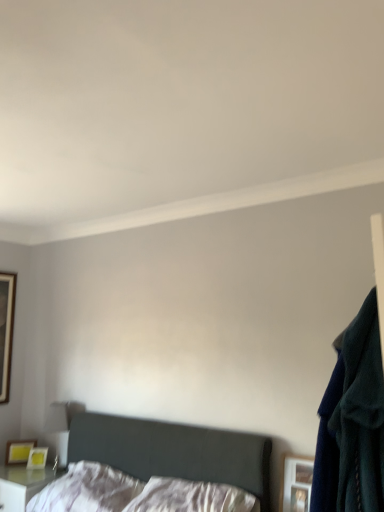
Question: Should I look upward or downward to see white soft pillow at lower center, arranged as the second pillow when viewed from the right?

Choices:
 (A) up
 (B) down

Answer: (B)

Question: Can you confirm if navy blue sweater at right is positioned to the right of white glossy nightstand at lower left?

Choices:
 (A) no
 (B) yes

Answer: (B)

Question: Does navy blue sweater at right appear on the left side of white glossy nightstand at lower left?

Choices:
 (A) yes
 (B) no

Answer: (B)

Question: Is navy blue sweater at right placed right next to white glossy nightstand at lower left?

Choices:
 (A) no
 (B) yes

Answer: (A)

Question: Considering the relative sizes of navy blue sweater at right and white glossy nightstand at lower left in the image provided, is navy blue sweater at right smaller than white glossy nightstand at lower left?

Choices:
 (A) yes
 (B) no

Answer: (A)

Question: Considering the relative sizes of navy blue sweater at right and white glossy nightstand at lower left in the image provided, is navy blue sweater at right thinner than white glossy nightstand at lower left?

Choices:
 (A) no
 (B) yes

Answer: (B)

Question: From the image's perspective, is navy blue sweater at right located beneath white glossy nightstand at lower left?

Choices:
 (A) yes
 (B) no

Answer: (B)

Question: Can you confirm if white glossy nightstand at lower left is positioned to the left of wooden picture frame at lower right, placed as the third picture frame when sorted from left to right?

Choices:
 (A) no
 (B) yes

Answer: (B)

Question: Is white glossy nightstand at lower left completely or partially outside of wooden picture frame at lower right, placed as the third picture frame when sorted from left to right?

Choices:
 (A) no
 (B) yes

Answer: (B)

Question: Is the depth of white glossy nightstand at lower left greater than that of wooden picture frame at lower right, marked as the 2th picture frame in a top-to-bottom arrangement?

Choices:
 (A) no
 (B) yes

Answer: (B)

Question: Are white glossy nightstand at lower left and wooden picture frame at lower right, placed as the third picture frame when sorted from left to right, making contact?

Choices:
 (A) no
 (B) yes

Answer: (A)

Question: From the image's perspective, does white glossy nightstand at lower left appear higher than wooden picture frame at lower right, acting as the second picture frame starting from the bottom?

Choices:
 (A) yes
 (B) no

Answer: (B)

Question: Is white glossy nightstand at lower left looking in the opposite direction of wooden picture frame at lower right, placed as the 1th picture frame when sorted from front to back?

Choices:
 (A) no
 (B) yes

Answer: (A)

Question: Is white satin pillow at center, arranged as the 1th pillow when viewed from the right, wider than matte yellow picture frame at lower left, marked as the 1th picture frame in a bottom-to-top arrangement?

Choices:
 (A) no
 (B) yes

Answer: (B)